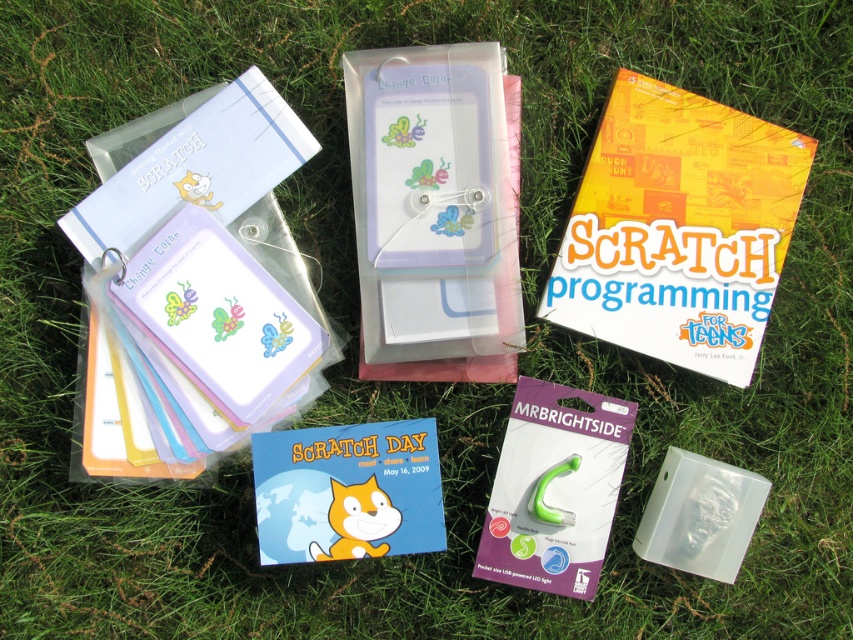
Consider the image. Can you confirm if matte plastic card at center is smaller than blue paper card at center?

Actually, matte plastic card at center might be larger than blue paper card at center.

Who is taller, matte plastic card at center or blue paper card at center?

With more height is matte plastic card at center.

Is point (402, 120) positioned behind point (422, 529)?

Yes, point (402, 120) is behind point (422, 529).

Where is `matte plastic card at center`? This screenshot has height=640, width=853. matte plastic card at center is located at coordinates (434, 211).

Which is behind, point (666, 564) or point (572, 458)?

The point (572, 458) is behind.

Is transparent plastic case at center taller than green translucent rubber at center?

Indeed, transparent plastic case at center has a greater height compared to green translucent rubber at center.

The height and width of the screenshot is (640, 853). Find the location of `transparent plastic case at center`. transparent plastic case at center is located at coordinates (700, 515).

Locate an element on the screen. transparent plastic case at center is located at coordinates pyautogui.click(x=700, y=515).

Is matte yellow cat at center shorter than green translucent rubber at center?

No.

Is point (379, 548) less distant than point (567, 461)?

Yes, it is in front of point (567, 461).

Locate an element on the screen. matte yellow cat at center is located at coordinates (357, 520).